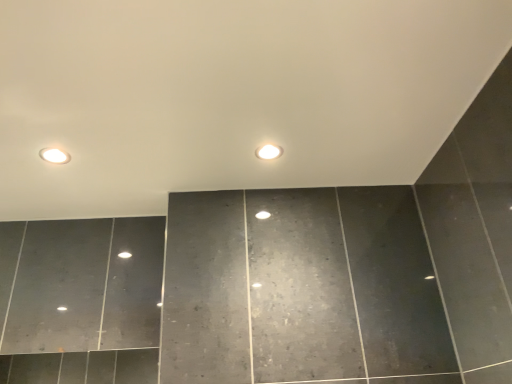
Question: Considering the relative sizes of matte white recessed light at upper left and white glossy light bulb at center in the image provided, is matte white recessed light at upper left bigger than white glossy light bulb at center?

Choices:
 (A) yes
 (B) no

Answer: (B)

Question: Is matte white recessed light at upper left outside of white glossy light bulb at center?

Choices:
 (A) no
 (B) yes

Answer: (B)

Question: Is matte white recessed light at upper left with white glossy light bulb at center?

Choices:
 (A) yes
 (B) no

Answer: (B)

Question: Considering the relative positions of matte white recessed light at upper left and white glossy light bulb at center in the image provided, is matte white recessed light at upper left in front of white glossy light bulb at center?

Choices:
 (A) yes
 (B) no

Answer: (A)

Question: From a real-world perspective, does matte white recessed light at upper left sit lower than white glossy light bulb at center?

Choices:
 (A) yes
 (B) no

Answer: (B)

Question: Is white glossy light bulb at center inside matte white recessed light at upper left?

Choices:
 (A) no
 (B) yes

Answer: (A)

Question: Can you confirm if white glossy light bulb at center is wider than matte white recessed light at upper left?

Choices:
 (A) no
 (B) yes

Answer: (A)

Question: Does white glossy light bulb at center have a greater height compared to matte white recessed light at upper left?

Choices:
 (A) no
 (B) yes

Answer: (B)

Question: Does white glossy light bulb at center come behind matte white recessed light at upper left?

Choices:
 (A) yes
 (B) no

Answer: (A)

Question: Can you confirm if white glossy light bulb at center is bigger than matte white recessed light at upper left?

Choices:
 (A) yes
 (B) no

Answer: (A)

Question: Is white glossy light bulb at center at the right side of matte white recessed light at upper left?

Choices:
 (A) yes
 (B) no

Answer: (A)

Question: Is white glossy light bulb at center not inside matte white recessed light at upper left?

Choices:
 (A) no
 (B) yes

Answer: (B)

Question: Which is correct: matte white recessed light at upper left is inside white glossy light bulb at center, or outside of it?

Choices:
 (A) outside
 (B) inside

Answer: (A)